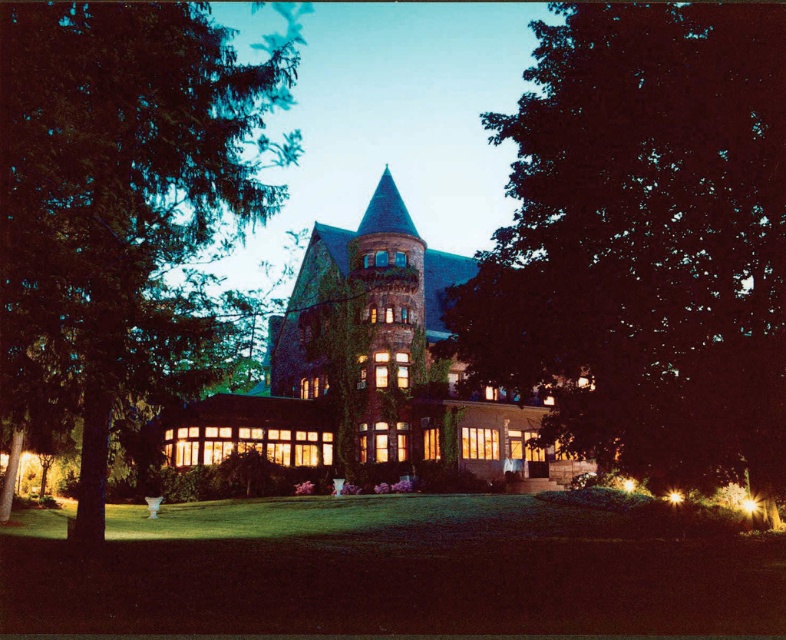
Can you confirm if green leafy tree at left is taller than green ivy-covered tower at center?

Yes, green leafy tree at left is taller than green ivy-covered tower at center.

Between green leafy tree at left and green ivy-covered tower at center, which one has less height?

Standing shorter between the two is green ivy-covered tower at center.

Is point (116, 348) farther from camera compared to point (365, 371)?

That is False.

What are the coordinates of `green leafy tree at left` in the screenshot? It's located at (116, 204).

Who is more distant from viewer, (x=680, y=58) or (x=250, y=131)?

Point (x=250, y=131)

The width and height of the screenshot is (786, 640). In order to click on green leafy tree at center in this screenshot , I will do `click(645, 241)`.

This screenshot has height=640, width=786. Identify the location of green leafy tree at center. (645, 241).

Between green leafy tree at center and green ivy-covered tower at center, which one is positioned higher?

Positioned higher is green leafy tree at center.

Which is behind, point (728, 365) or point (322, 310)?

The point (322, 310) is behind.

Find the location of `green leafy tree at center`. green leafy tree at center is located at coordinates (645, 241).

Find the location of a particular element. This screenshot has height=640, width=786. green leafy tree at center is located at coordinates (645, 241).